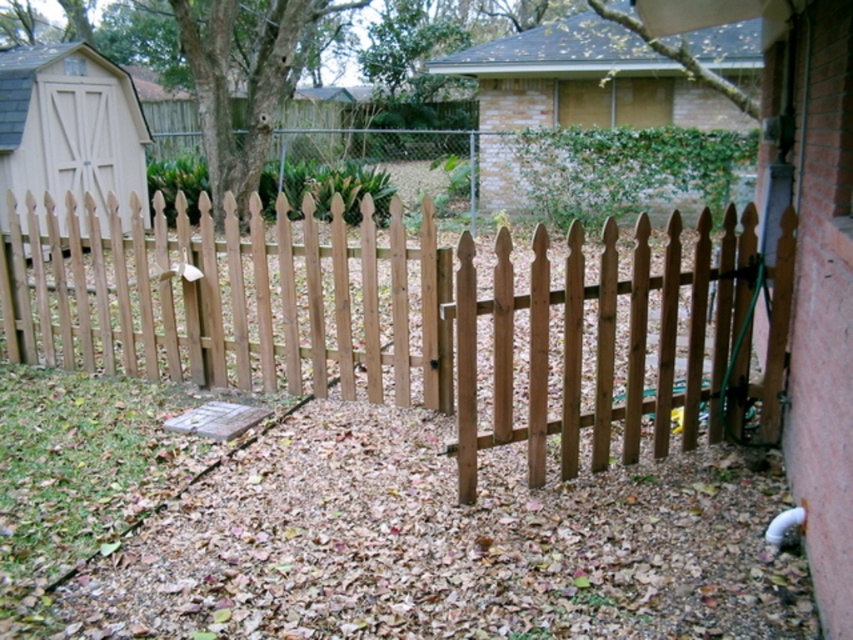
In the scene shown: You are standing in the backyard and want to walk through the gate of the light brown wood picket fence at center. Based on its position, can you estimate whether the gate is on the left or right side of the fence?

The light brown wood picket fence at center is located at point (x=405, y=317), which is near the center of the image. Since the gate is slightly ajar and positioned at the center of the fence, the gate is likely in the middle, so it doesn not have a distinct left or right side. However, if the gate opens to one side, it might be on either side depending on the direction it swings. But according to the description, the gate is part of the fence at center, so the entrance is at the center.

You are standing in the backyard looking at the wooden picket fence with a slightly ajar gate and the small shed to the left. There is a point marked at coordinates point (277, 300). Can you estimate how far this point is from your current position?

The point (277, 300) is 6.99 meters away from the viewer, so the distance is approximately 7 meters.